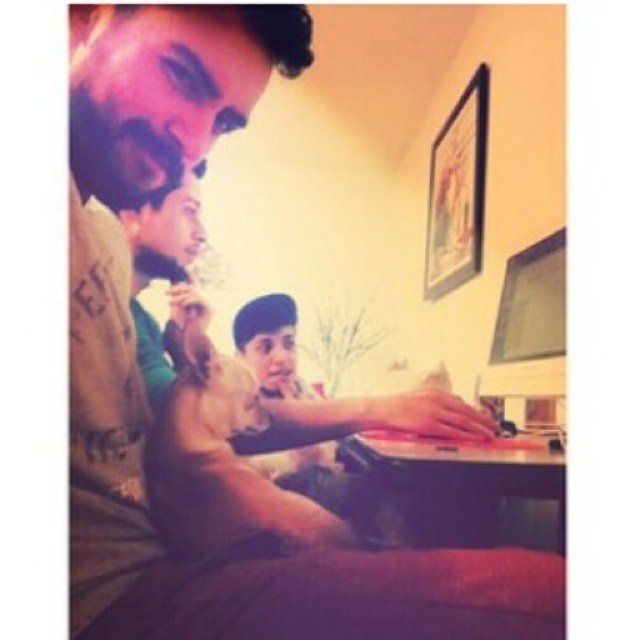
Based on the scene description, which object is taller between the matte brown shirt at left and the matte brown hair at upper left?

The matte brown shirt at left is taller than the matte brown hair at upper left.

You are trying to determine which object in the scene is larger between the matte brown hair at upper left and the matte plastic monitor at upper right. Based on the spatial details provided, which one is larger?

The matte brown hair at upper left is bigger than the matte plastic monitor at upper right according to the description.

You are standing in the room and want to know which object is located below the other between the matte brown shirt at left and the matte brown hair at upper left. Can you tell me which one is positioned lower?

The matte brown shirt at left is positioned under matte brown hair at upper left, so the matte brown shirt at left is located below the matte brown hair at upper left.